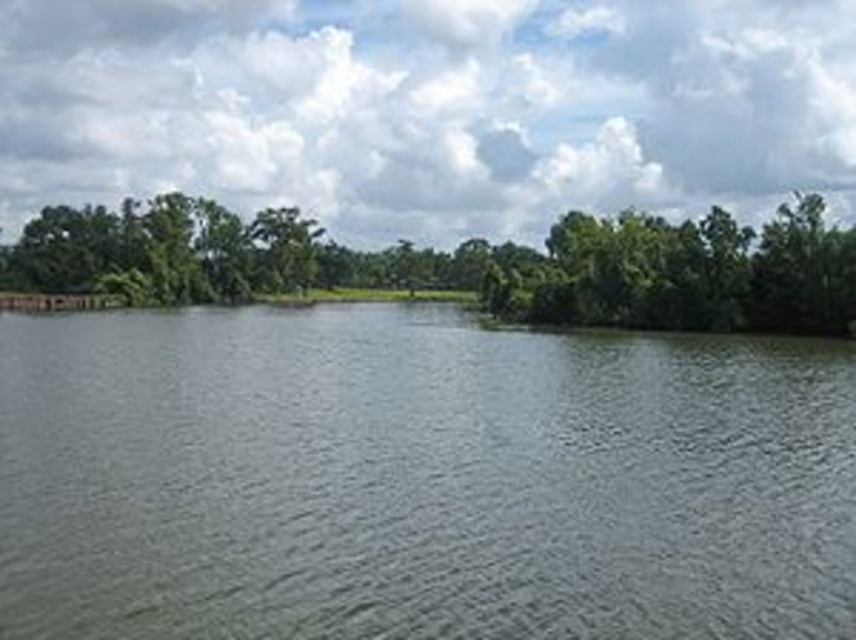
Question: Can you confirm if gray smooth water at center is positioned above green leafy trees at center?

Choices:
 (A) yes
 (B) no

Answer: (B)

Question: Is gray smooth water at center thinner than green leafy trees at center?

Choices:
 (A) no
 (B) yes

Answer: (B)

Question: Which object is closer to the camera taking this photo?

Choices:
 (A) gray smooth water at center
 (B) green leafy trees at center

Answer: (A)

Question: Which object is farther from the camera taking this photo?

Choices:
 (A) gray smooth water at center
 (B) green leafy trees at center

Answer: (B)

Question: Is gray smooth water at center positioned before green leafy trees at center?

Choices:
 (A) yes
 (B) no

Answer: (A)